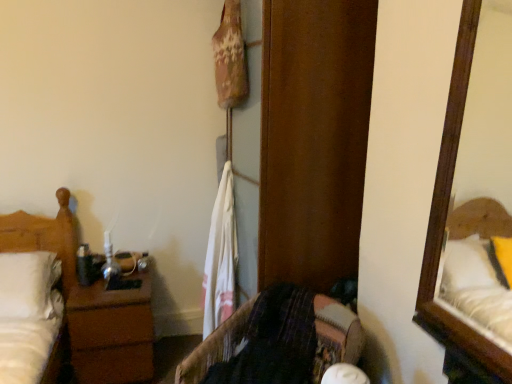
The image size is (512, 384). In order to click on white matte bed at left in this screenshot , I will do `click(45, 236)`.

Describe the element at coordinates (220, 257) in the screenshot. I see `white cotton towel at center` at that location.

What is the approximate width of velvet-like fabric chair at center?

57.67 centimeters.

At what (x,y) coordinates should I click in order to perform the action: click on velvet-like fabric chair at center. Please return your answer as a coordinate pair (x, y). Image resolution: width=512 pixels, height=384 pixels. Looking at the image, I should click on (339, 328).

Locate an element on the screen. white matte bed at left is located at coordinates (45, 236).

Is brown wood nightstand at left thinner than velvet-like fabric chair at center?

Yes, brown wood nightstand at left is thinner than velvet-like fabric chair at center.

From a real-world perspective, which object stands above the other?

velvet-like fabric chair at center is physically above.

This screenshot has width=512, height=384. I want to click on nightstand below the velvet-like fabric chair at center (from the image's perspective), so tap(111, 333).

From the image's perspective, is brown wood nightstand at left on velvet-like fabric chair at center?

No, from the image's perspective, brown wood nightstand at left is not above velvet-like fabric chair at center.

Is white matte bed at left next to white cotton towel at center?

No.

Does point (26, 231) lie behind point (227, 169)?

Yes, it is.

Is the position of white matte bed at left less distant than that of white cotton towel at center?

No, white matte bed at left is further to the viewer.

Is point (227, 300) closer or farther from the camera than point (63, 273)?

Point (227, 300) is closer to the camera than point (63, 273).

Is white cotton towel at center at the left side of white matte bed at left?

Incorrect, white cotton towel at center is not on the left side of white matte bed at left.

From the picture: How far apart are white cotton towel at center and white matte bed at left?

white cotton towel at center and white matte bed at left are 35.64 inches apart from each other.

Is white cotton towel at center far from white matte bed at left?

No, white cotton towel at center is in close proximity to white matte bed at left.

Measure the distance from white cotton towel at center to velvet-like fabric chair at center.

A distance of 15.55 inches exists between white cotton towel at center and velvet-like fabric chair at center.

Is point (226, 292) positioned before point (338, 348)?

No, (226, 292) is further to viewer.

Considering the relative positions of white cotton towel at center and velvet-like fabric chair at center in the image provided, is white cotton towel at center behind velvet-like fabric chair at center?

That is True.

Would you consider white cotton towel at center to be distant from velvet-like fabric chair at center?

No, white cotton towel at center is in close proximity to velvet-like fabric chair at center.

Is white cotton towel at center far away from brown wood nightstand at left?

Actually, white cotton towel at center and brown wood nightstand at left are a little close together.

Who is taller, white cotton towel at center or brown wood nightstand at left?

Standing taller between the two is white cotton towel at center.

From the image's perspective, does white cotton towel at center appear higher than brown wood nightstand at left?

Indeed, from the image's perspective, white cotton towel at center is shown above brown wood nightstand at left.

How different are the orientations of velvet-like fabric chair at center and white matte bed at left in degrees?

There is a 61.1-degree angle between the facing directions of velvet-like fabric chair at center and white matte bed at left.

From a real-world perspective, which is physically above, velvet-like fabric chair at center or white matte bed at left?

white matte bed at left is physically above.

Which is less distant, (185,373) or (25,243)?

Point (185,373) appears to be closer to the viewer than point (25,243).

Is velvet-like fabric chair at center next to white matte bed at left?

No, velvet-like fabric chair at center is not making contact with white matte bed at left.

Is point (232, 316) farther from camera compared to point (126, 353)?

No, (232, 316) is closer to viewer.

Is brown wood nightstand at left inside velvet-like fabric chair at center?

Definitely not — brown wood nightstand at left is not inside velvet-like fabric chair at center.

Which of these two, velvet-like fabric chair at center or brown wood nightstand at left, is wider?

velvet-like fabric chair at center.

Is there a large distance between velvet-like fabric chair at center and brown wood nightstand at left?

No.

Image resolution: width=512 pixels, height=384 pixels. What are the coordinates of `nightstand beneath the velvet-like fabric chair at center (from a real-world perspective)` in the screenshot? It's located at (111, 333).

This screenshot has width=512, height=384. Find the location of `laundry that appears on the right of white matte bed at left`. laundry that appears on the right of white matte bed at left is located at coordinates (220, 257).

Considering their positions, is white cotton towel at center positioned further to white matte bed at left than brown wood nightstand at left?

white cotton towel at center.

From the image, which object appears to be nearer to brown wood nightstand at left, velvet-like fabric chair at center or white cotton towel at center?

white cotton towel at center lies closer to brown wood nightstand at left than the other object.

Based on their spatial positions, is white matte bed at left or white cotton towel at center further from brown wood nightstand at left?

white cotton towel at center.

Considering their positions, is brown wood nightstand at left positioned closer to velvet-like fabric chair at center than white cotton towel at center?

The object closer to velvet-like fabric chair at center is white cotton towel at center.

Considering their positions, is white matte bed at left positioned further to velvet-like fabric chair at center than white cotton towel at center?

The object further to velvet-like fabric chair at center is white matte bed at left.

Considering their positions, is white cotton towel at center positioned further to velvet-like fabric chair at center than brown wood nightstand at left?

brown wood nightstand at left.

Estimate the real-world distances between objects in this image. Which object is further from white cotton towel at center, brown wood nightstand at left or velvet-like fabric chair at center?

brown wood nightstand at left is positioned further to the anchor white cotton towel at center.

Looking at the image, which one is located closer to white matte bed at left, velvet-like fabric chair at center or brown wood nightstand at left?

Based on the image, brown wood nightstand at left appears to be nearer to white matte bed at left.

This screenshot has height=384, width=512. Find the location of `laundry positioned between velvet-like fabric chair at center and brown wood nightstand at left from near to far`. laundry positioned between velvet-like fabric chair at center and brown wood nightstand at left from near to far is located at coordinates (220, 257).

Identify the location of laundry situated between white matte bed at left and velvet-like fabric chair at center from left to right. Image resolution: width=512 pixels, height=384 pixels. (220, 257).

Identify the location of nightstand between white matte bed at left and white cotton towel at center from left to right. (111, 333).

This screenshot has height=384, width=512. Identify the location of nightstand between white matte bed at left and velvet-like fabric chair at center in the horizontal direction. (111, 333).